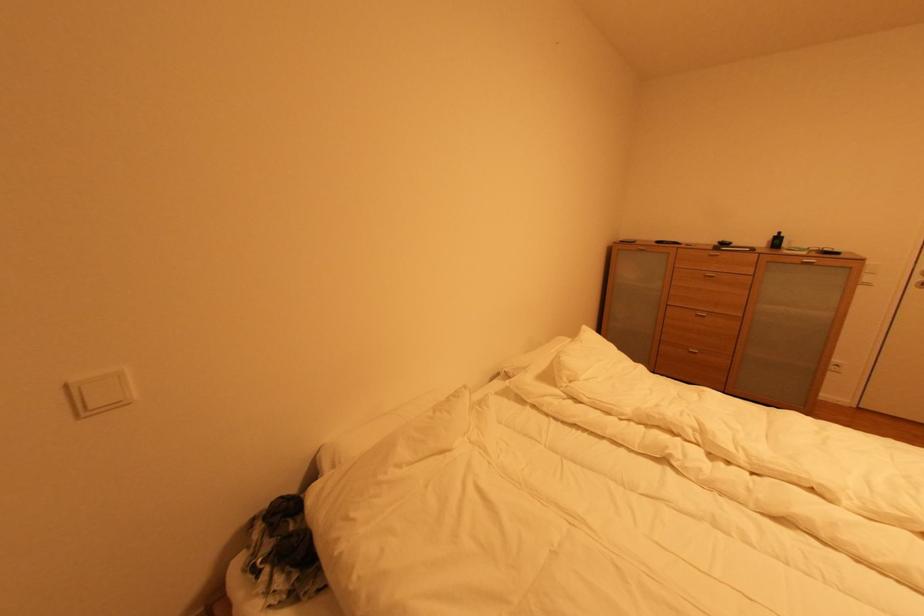
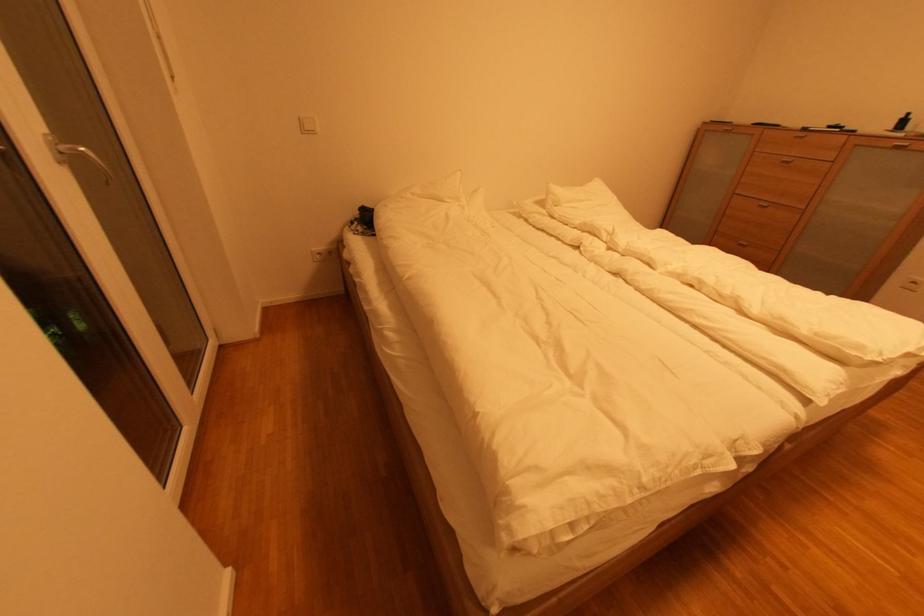
The point at (783, 236) is marked in the first image. Where is the corresponding point in the second image?

(908, 118)